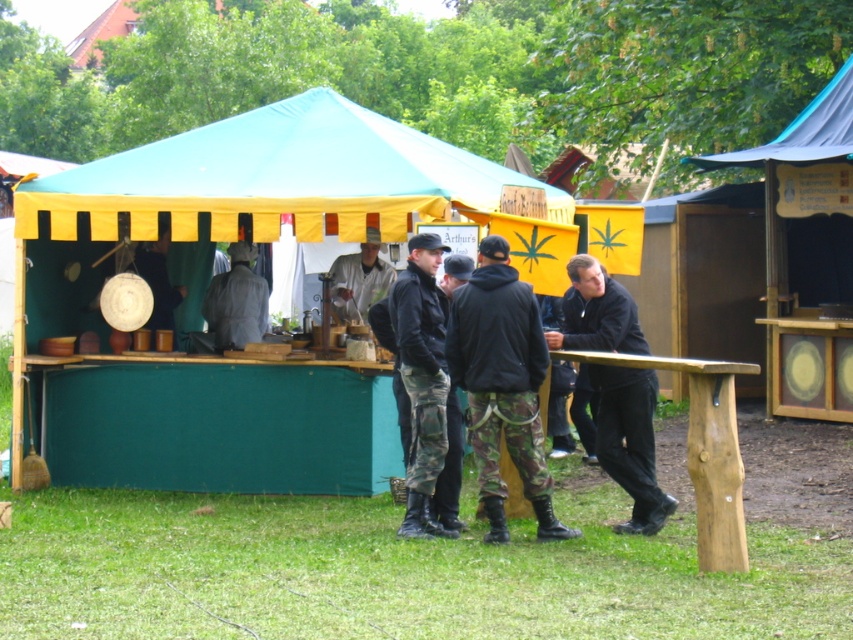
Who is positioned more to the right, black matte jacket at center or light gray fabric jacket at center?

From the viewer's perspective, black matte jacket at center appears more on the right side.

Which of these two, black matte jacket at center or light gray fabric jacket at center, stands shorter?

light gray fabric jacket at center is shorter.

At what (x,y) coordinates should I click in order to perform the action: click on black matte jacket at center. Please return your answer as a coordinate pair (x, y). The height and width of the screenshot is (640, 853). Looking at the image, I should click on (630, 442).

Who is positioned more to the right, teal fabric tent at center or silver metallic shirt at center?

From the viewer's perspective, silver metallic shirt at center appears more on the right side.

Is the position of teal fabric tent at center more distant than that of silver metallic shirt at center?

No, teal fabric tent at center is closer to the viewer.

Is point (244, 113) in front of point (360, 323)?

No, (244, 113) is behind (360, 323).

The height and width of the screenshot is (640, 853). I want to click on teal fabric tent at center, so click(x=252, y=200).

Is light gray fabric jacket at center shorter than silver metallic shirt at center?

Incorrect, light gray fabric jacket at center's height does not fall short of silver metallic shirt at center's.

Which is more to the right, light gray fabric jacket at center or silver metallic shirt at center?

silver metallic shirt at center

Who is more distant from viewer, (242, 307) or (363, 275)?

Positioned behind is point (363, 275).

The width and height of the screenshot is (853, 640). Identify the location of light gray fabric jacket at center. (236, 300).